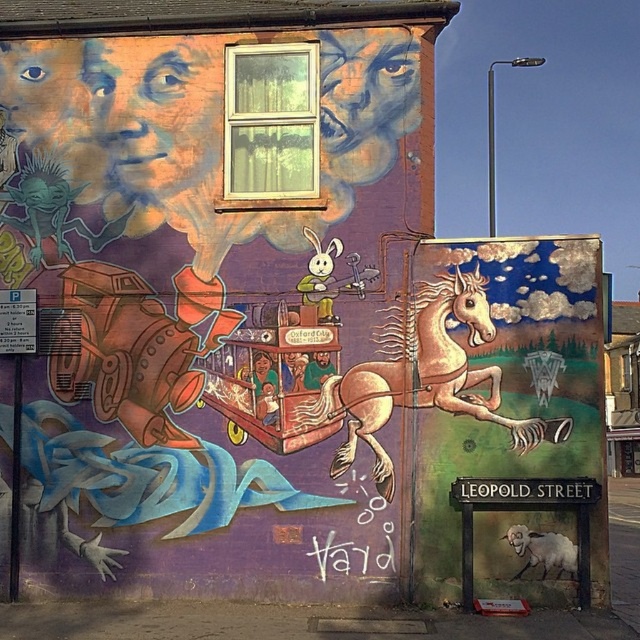
You are standing in front of the mural and notice two points marked on it. The first point is at coordinates point (486, 330) and the second is at point (496, 232). Which point is closer to you?

Point (486, 330) is closer to the viewer than point (496, 232).

In the scene shown: You are an artist planning to add a new element to the mural. You have a golden dragon sculpture that is 1.2 meters wide. The space between the pastel pink paper horse at center and the black metal streetlight at upper right is 1.5 meters. Will the dragon fit in that space?

The space between the pastel pink paper horse at center and the black metal streetlight at upper right is 1.5 meters, which is wider than the dragon sculpture of 1.2 meters. Therefore, the dragon can fit in that space.

You are an artist standing at the point labeled point (420, 372). Looking at the vibrant and eclectic mural described, which object is directly in front of you?

The point (420, 372) corresponds to the pastel pink paper horse at center, so the object directly in front is the pastel pink paper horse at center.